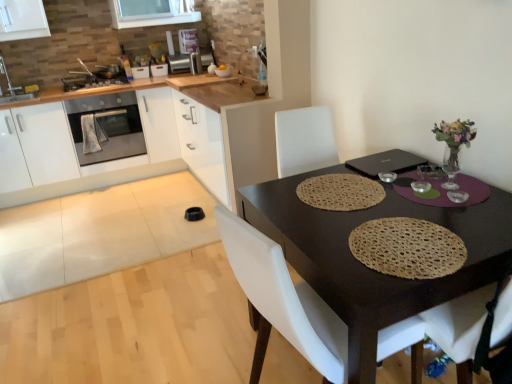
I want to click on vacant space to the left of woven beige placemat at table center, so click(321, 241).